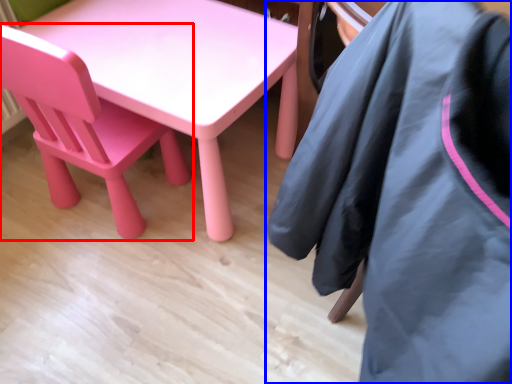
Question: Which of the following is the closest to the observer, chair (highlighted by a red box) or jacket (highlighted by a blue box)?

Choices:
 (A) chair
 (B) jacket

Answer: (B)